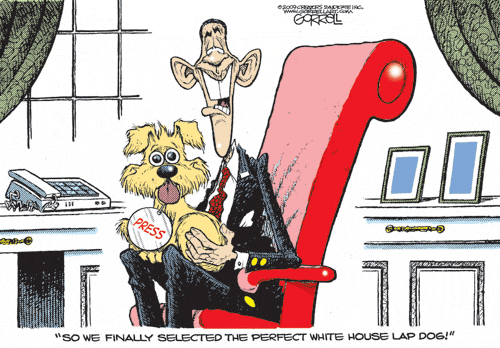
Image resolution: width=500 pixels, height=348 pixels. In order to click on back wall in this screenshot , I will do `click(394, 8)`, `click(267, 23)`, `click(436, 92)`.